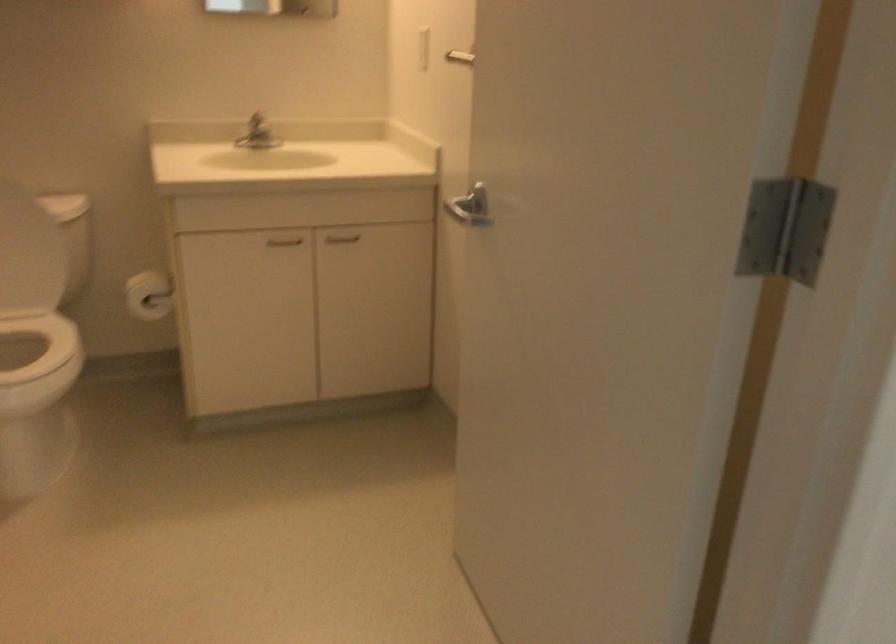
Locate an element on the screen. Image resolution: width=896 pixels, height=644 pixels. silver faucet handle is located at coordinates (255, 133).